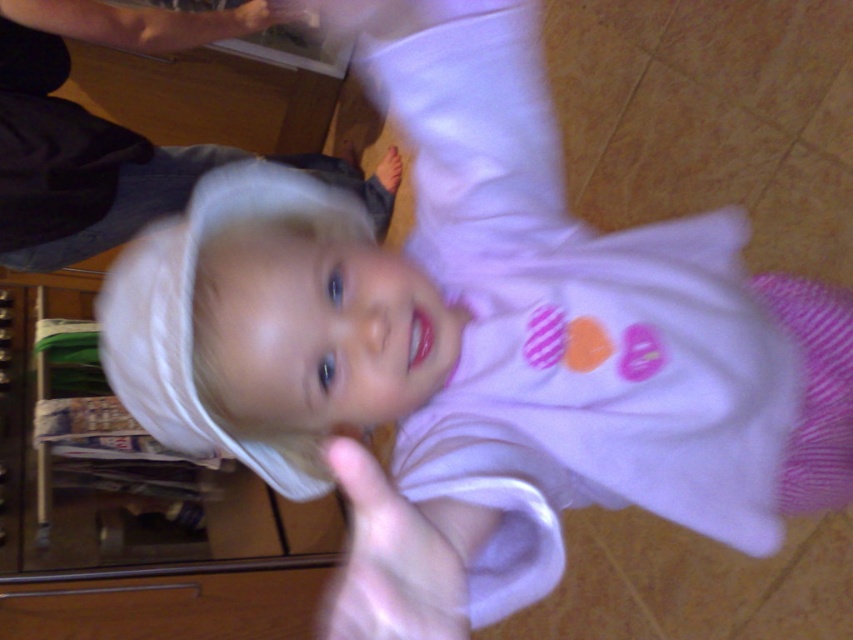
Which is below, white fabric at upper center or smooth skin hand at upper center?

white fabric at upper center is lower down.

Locate an element on the screen. The width and height of the screenshot is (853, 640). white fabric at upper center is located at coordinates 85,132.

Between point (350, 173) and point (236, 26), which one is positioned in front?

Point (236, 26)

This screenshot has height=640, width=853. Identify the location of white fabric at upper center. (85, 132).

Is white fabric at upper center positioned at the back of pink fabric hand at center?

Yes, it is.

In the scene shown: Between white fabric at upper center and pink fabric hand at center, which one is positioned lower?

Positioned lower is pink fabric hand at center.

Is point (94, 141) farther from viewer compared to point (486, 515)?

Yes, point (94, 141) is behind point (486, 515).

In order to click on white fabric at upper center in this screenshot , I will do `click(85, 132)`.

Is point (378, 582) closer to viewer compared to point (289, 3)?

Yes, point (378, 582) is closer to viewer.

Does pink fabric hand at center have a lesser height compared to smooth skin hand at upper center?

Indeed, pink fabric hand at center has a lesser height compared to smooth skin hand at upper center.

Find the location of `pink fabric hand at center`. pink fabric hand at center is located at coordinates (397, 557).

This screenshot has height=640, width=853. In order to click on pink fabric hand at center in this screenshot , I will do (397, 557).